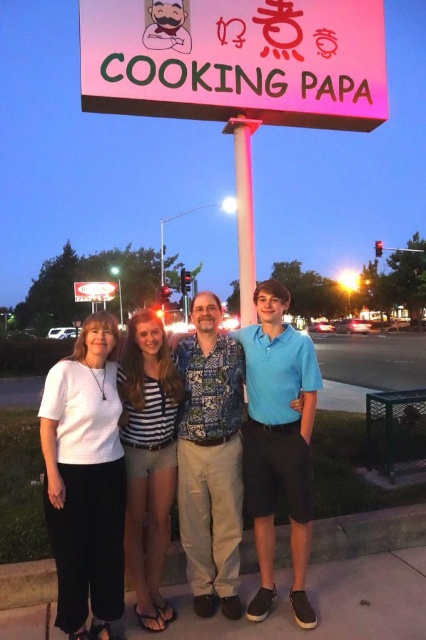
You are a photographer at the scene and want to ensure all subjects are visible in the photo. Which subject should you focus on to include both the white cotton shirt at center and the white matte shirt at left without cropping?

You should focus on the white cotton shirt at center since it is taller than the white matte shirt at left, ensuring both are visible in the frame.

In the scene shown: You are a photographer trying to capture the group in front of the COOKING PAPA sign. You notice the white cotton shirt at center and the metallic pole at center. Which object should you focus on to ensure the other is in the background?

You should focus on the white cotton shirt at center because it is in front of the metallic pole at center, so the metallic pole will be in the background.